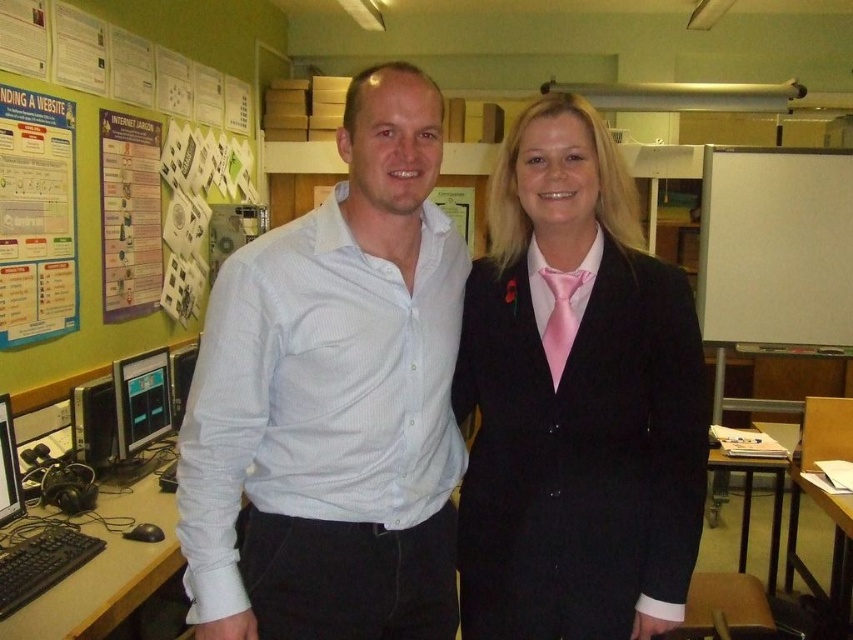
Can you confirm if white paper at upper left is positioned below black glossy monitor at left?

No.

The width and height of the screenshot is (853, 640). What do you see at coordinates (36, 218) in the screenshot?
I see `white paper at upper left` at bounding box center [36, 218].

This screenshot has height=640, width=853. Identify the location of white paper at upper left. (36, 218).

Does black glossy monitor at left have a smaller size compared to matte black monitor at left?

No, black glossy monitor at left is not smaller than matte black monitor at left.

Is black glossy monitor at left closer to the viewer compared to matte black monitor at left?

No, black glossy monitor at left is further to the viewer.

What do you see at coordinates (141, 400) in the screenshot?
I see `black glossy monitor at left` at bounding box center [141, 400].

This screenshot has width=853, height=640. What are the coordinates of `black glossy monitor at left` in the screenshot? It's located at (141, 400).

How distant is white matte board at right from purple paper poster at upper left?

9.52 feet

Is white matte board at right above purple paper poster at upper left?

Incorrect, white matte board at right is not positioned above purple paper poster at upper left.

Identify the location of white matte board at right. (775, 246).

The height and width of the screenshot is (640, 853). Identify the location of white matte board at right. (775, 246).